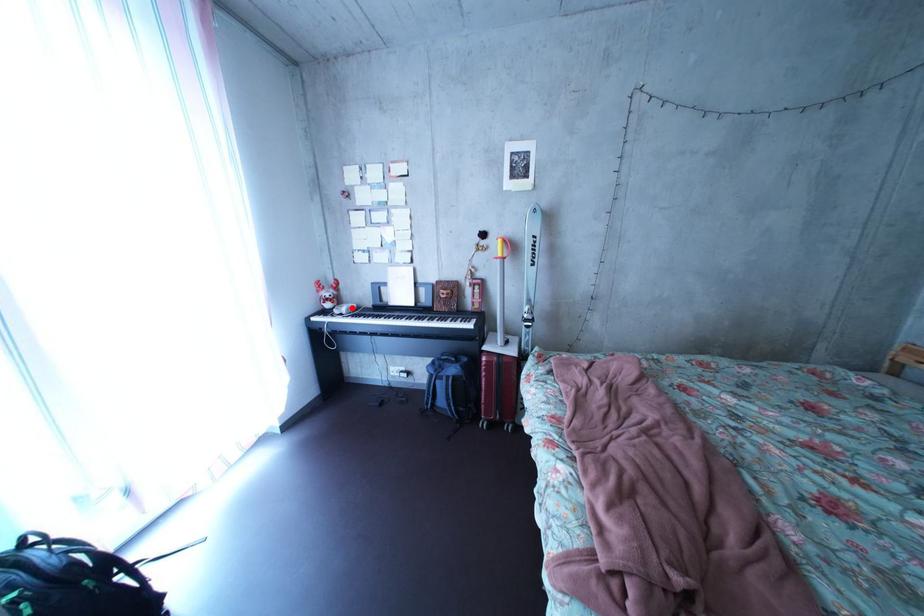
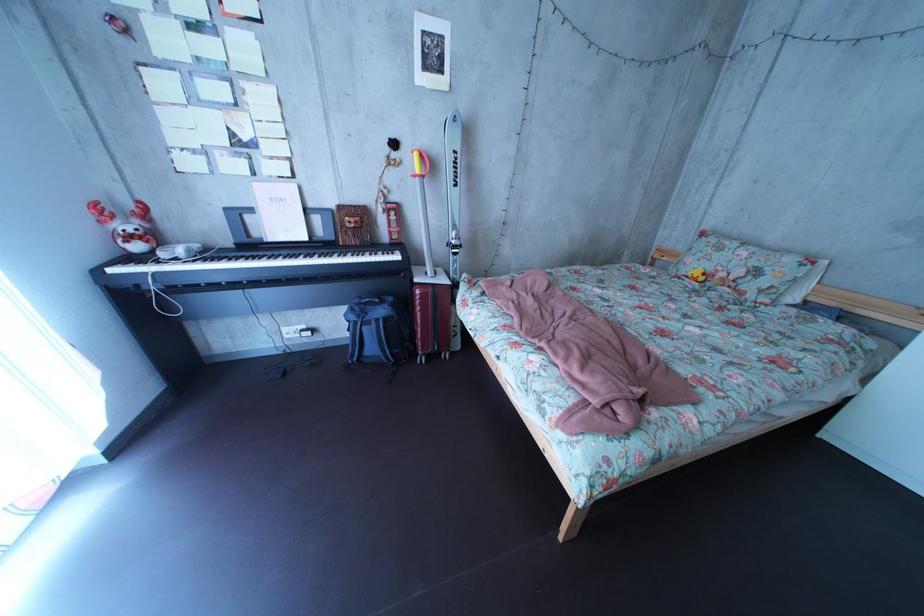
In the second image, find the point that corresponds to the highlighted location in the first image.

(169, 246)